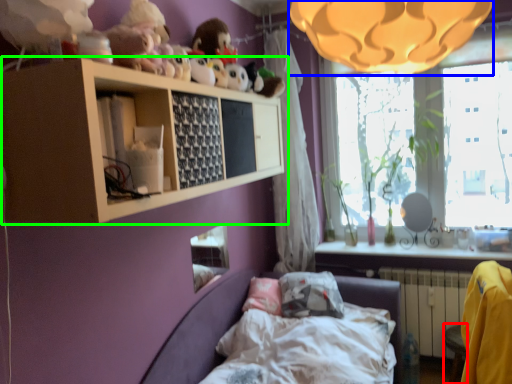
Question: Which is farther away from furniture (highlighted by a red box)? lamp (highlighted by a blue box) or shelf (highlighted by a green box)?

Choices:
 (A) lamp
 (B) shelf

Answer: (A)